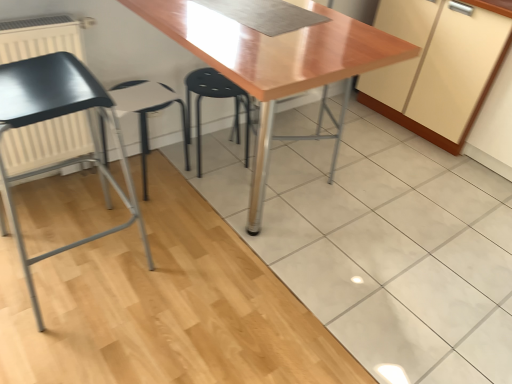
Question: Is white matte radiator at left facing towards black plastic stool at center?

Choices:
 (A) yes
 (B) no

Answer: (B)

Question: Is white matte radiator at left bigger than black plastic stool at center?

Choices:
 (A) no
 (B) yes

Answer: (A)

Question: Considering the relative sizes of white matte radiator at left and black plastic stool at center in the image provided, is white matte radiator at left smaller than black plastic stool at center?

Choices:
 (A) no
 (B) yes

Answer: (B)

Question: From a real-world perspective, is white matte radiator at left over black plastic stool at center?

Choices:
 (A) yes
 (B) no

Answer: (A)

Question: Can you confirm if white matte radiator at left is wider than black plastic stool at center?

Choices:
 (A) no
 (B) yes

Answer: (A)

Question: Is white plastic stool at center inside the boundaries of matte black chair at left, or outside?

Choices:
 (A) inside
 (B) outside

Answer: (B)

Question: Considering their positions, is white plastic stool at center located in front of or behind matte black chair at left?

Choices:
 (A) front
 (B) behind

Answer: (B)

Question: In terms of width, does white plastic stool at center look wider or thinner when compared to matte black chair at left?

Choices:
 (A) thin
 (B) wide

Answer: (A)

Question: From a real-world perspective, is white plastic stool at center positioned above or below matte black chair at left?

Choices:
 (A) below
 (B) above

Answer: (A)

Question: Considering the positions of point (80, 94) and point (185, 77), is point (80, 94) closer or farther from the camera than point (185, 77)?

Choices:
 (A) farther
 (B) closer

Answer: (B)

Question: Relative to black plastic stool at center, is matte black chair at left in front or behind?

Choices:
 (A) behind
 (B) front

Answer: (B)

Question: In terms of width, does matte black chair at left look wider or thinner when compared to black plastic stool at center?

Choices:
 (A) wide
 (B) thin

Answer: (A)

Question: Would you say matte black chair at left is inside or outside black plastic stool at center?

Choices:
 (A) inside
 (B) outside

Answer: (B)

Question: From the image's perspective, relative to matte black chair at left, is black plastic stool at center above or below?

Choices:
 (A) below
 (B) above

Answer: (B)

Question: Considering the relative positions of black plastic stool at center and matte black chair at left in the image provided, is black plastic stool at center to the left or to the right of matte black chair at left?

Choices:
 (A) right
 (B) left

Answer: (A)